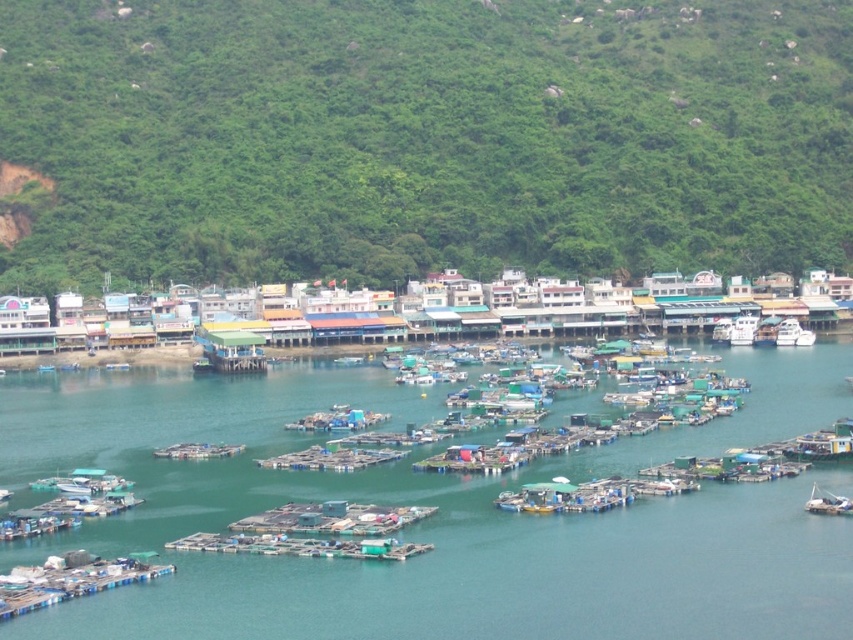
Question: Where is green water at center located in relation to metallic gray boat at lower right in the image?

Choices:
 (A) below
 (B) above

Answer: (B)

Question: Which of the following is the farthest from the observer?

Choices:
 (A) (821, 506)
 (B) (611, 560)
 (C) (178, 451)

Answer: (C)

Question: From the image, what is the correct spatial relationship of blue plastic dock at lower left in relation to white glossy boat at center-right?

Choices:
 (A) right
 (B) left

Answer: (B)

Question: Is green leafy hillside at upper center to the right of metallic gray boat at lower right from the viewer's perspective?

Choices:
 (A) yes
 (B) no

Answer: (B)

Question: Which point is closer to the camera?

Choices:
 (A) white glossy boat at center-right
 (B) green plastic boats at center

Answer: (B)

Question: Which of the following is the farthest from the observer?

Choices:
 (A) white glossy boat at center-right
 (B) blue plastic dock at lower left
 (C) green water at center
 (D) metallic gray boat at lower right

Answer: (A)